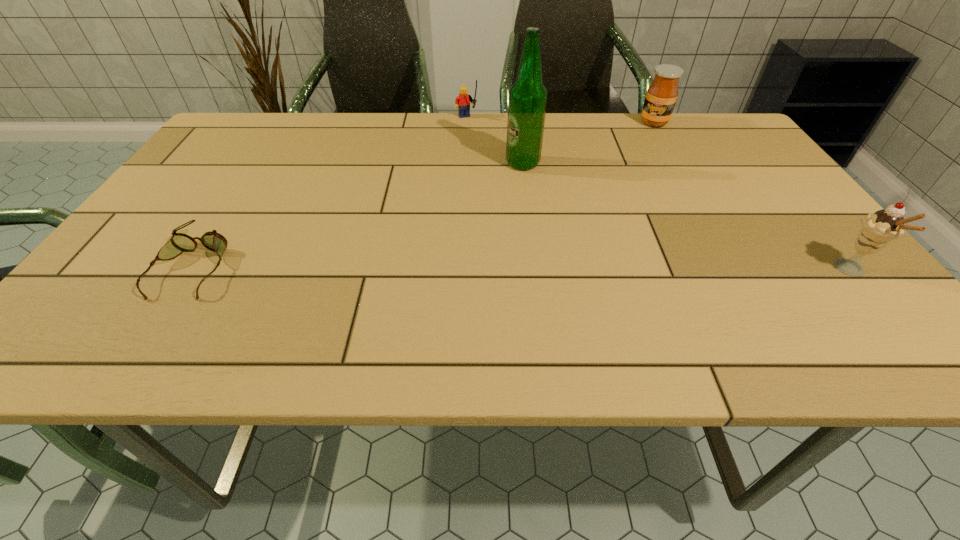
The height and width of the screenshot is (540, 960). I want to click on vacant space at the left edge of the desktop, so [161, 244].

Where is `free region at the right edge`? The width and height of the screenshot is (960, 540). free region at the right edge is located at coordinates (756, 215).

This screenshot has width=960, height=540. Identify the location of vacant position at the near left corner of the desktop. (95, 298).

Where is `vacant point at the far right corner`? The height and width of the screenshot is (540, 960). vacant point at the far right corner is located at coordinates (730, 152).

You are a GUI agent. You are given a task and a screenshot of the screen. Output one action in this format:
    pyautogui.click(x=<x>, y=<y>)
    Task: Click on the vacant space in between the icecream and the third farthest object
    The height and width of the screenshot is (540, 960).
    Given the screenshot: What is the action you would take?
    pyautogui.click(x=687, y=217)

At what (x,y) coordinates should I click in order to perform the action: click on empty location between the shortest object and the third tallest object. Please return your answer as a coordinate pair (x, y). Looking at the image, I should click on (424, 194).

Where is `empty space that is in between the shortest object and the tallest object`? empty space that is in between the shortest object and the tallest object is located at coordinates tap(359, 214).

You are a GUI agent. You are given a task and a screenshot of the screen. Output one action in this format:
    pyautogui.click(x=<x>, y=<y>)
    Task: Click on the empty space between the leftmost object and the tallest object
    This screenshot has width=960, height=540.
    Given the screenshot: What is the action you would take?
    pyautogui.click(x=359, y=214)

At what (x,y) coordinates should I click in order to perform the action: click on free space between the icecream and the third tallest object. Please return your answer as a coordinate pair (x, y). The height and width of the screenshot is (540, 960). Looking at the image, I should click on (753, 197).

You are a GUI agent. You are given a task and a screenshot of the screen. Output one action in this format:
    pyautogui.click(x=<x>, y=<y>)
    Task: Click on the free space between the second shortest object and the honey
    This screenshot has height=540, width=960.
    Given the screenshot: What is the action you would take?
    pyautogui.click(x=560, y=121)